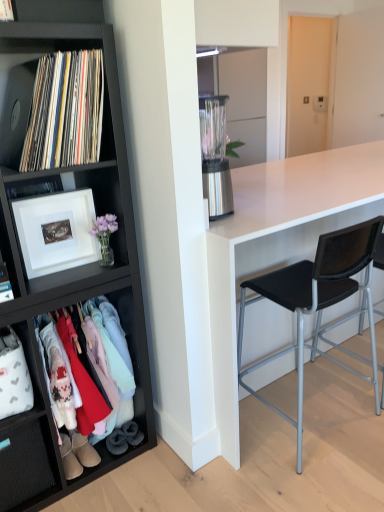
At what (x,y) coordinates should I click in order to perform the action: click on vacant area that lies to the right of leather boot at lower left, which is the first footwear from left to right. Please return your answer as a coordinate pair (x, y). This screenshot has height=512, width=384. Looking at the image, I should click on (104, 475).